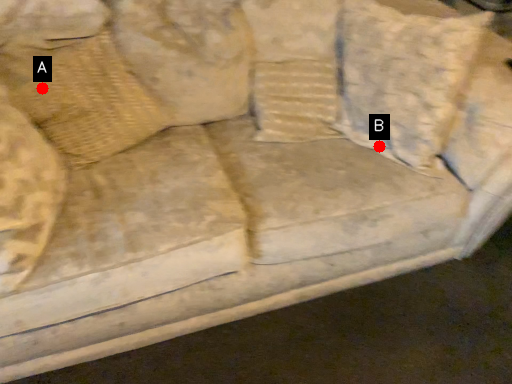
Question: Two points are circled on the image, labeled by A and B beside each circle. Among these points, which one is farthest from the camera?

Choices:
 (A) A is further
 (B) B is further

Answer: (B)